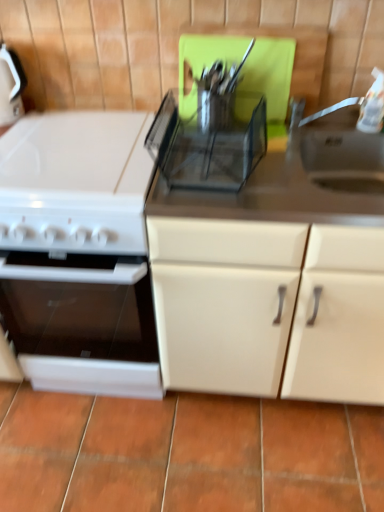
The image size is (384, 512). I want to click on free space above terracotta tile at lower center (from a real-world perspective), so click(179, 448).